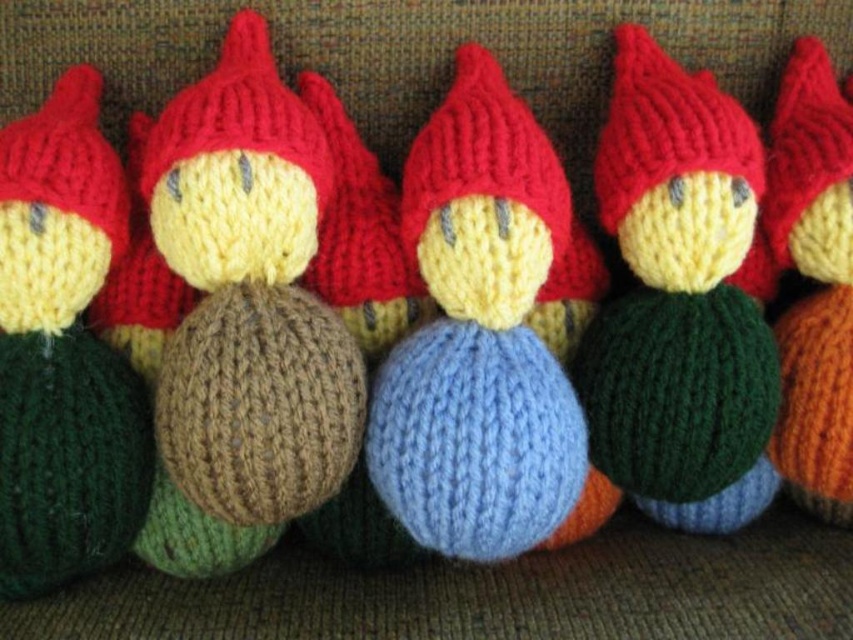
You are a child who is 3 feet tall and standing in front of the blue knitted ball at center. If you want to pick it up, will you be able to reach it?

The blue knitted ball at center and viewer are 36.89 inches apart from each other. Since the child is 3 feet tall, which is 36 inches, the distance between the child and the ball is slightly more than their height. Therefore, the child might need to take a step forward to reach it.

You are arranging these knitted figures on a shelf. You want to place a small decorative item between the green knitted ball at left and the green knitted ball at center. Can you fit it there?

The green knitted ball at left is behind the green knitted ball at center, so there is no space between them for a decorative item. You cannot fit it there.